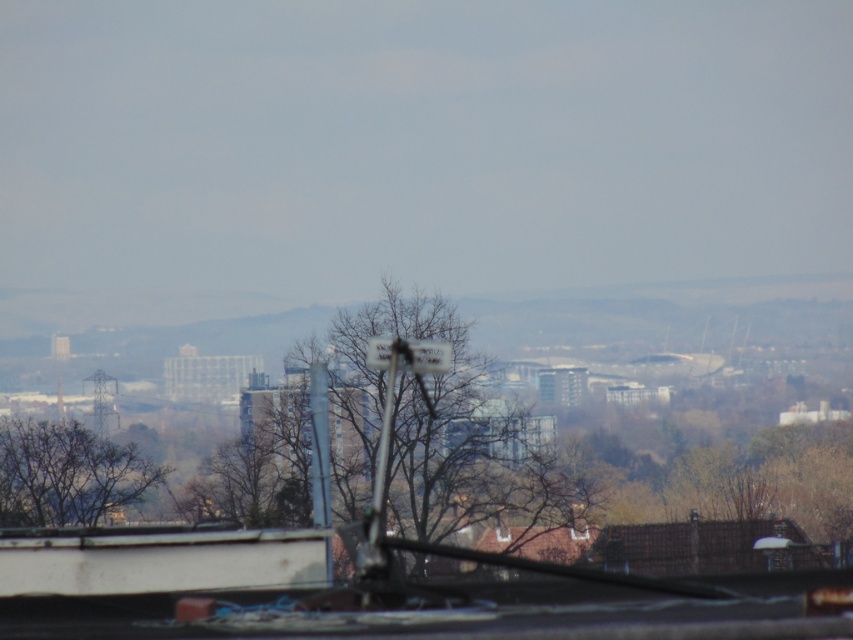
Question: Does brown leafless tree at lower left lie in front of white plastic street sign at center?

Choices:
 (A) yes
 (B) no

Answer: (B)

Question: Does brown leafless tree at lower left come behind white plastic street sign at center?

Choices:
 (A) yes
 (B) no

Answer: (A)

Question: Can you confirm if brown leafless tree at lower left is positioned to the right of white plastic street sign at center?

Choices:
 (A) no
 (B) yes

Answer: (A)

Question: Which point is closer to the camera taking this photo?

Choices:
 (A) (30, 433)
 (B) (387, 365)

Answer: (B)